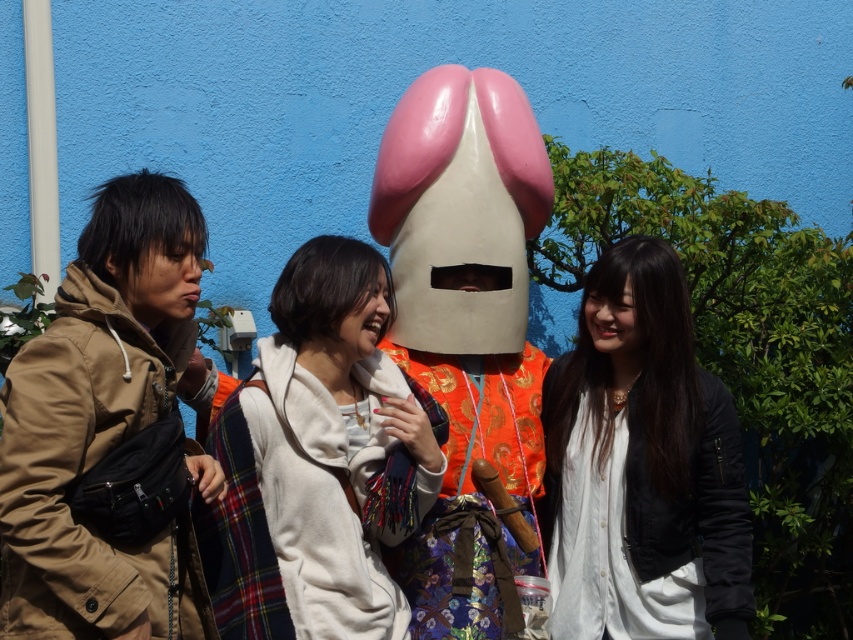
You are a photographer trying to capture a clear shot of the white soft scarf at center. However, the black leather jacket at right is blocking your view. Can you move around to the left side of the jacket to get an unobstructed view of the scarf?

The white soft scarf at center is behind the black leather jacket at right, so moving to the left side of the black leather jacket at right might allow you to see around it and get a clearer view of the white soft scarf at center.

You are a photographer trying to capture a group photo of the black leather jacket at right and the orange fabric costume at center. The camera you are using has a minimum focus distance of 50 centimeters. Can you take the photo without moving either object?

The distance between the black leather jacket at right and the orange fabric costume at center is 50.37 centimeters, which is just over the camera minimum focus distance of 50 centimeters. Therefore, you can take the photo without moving either object.